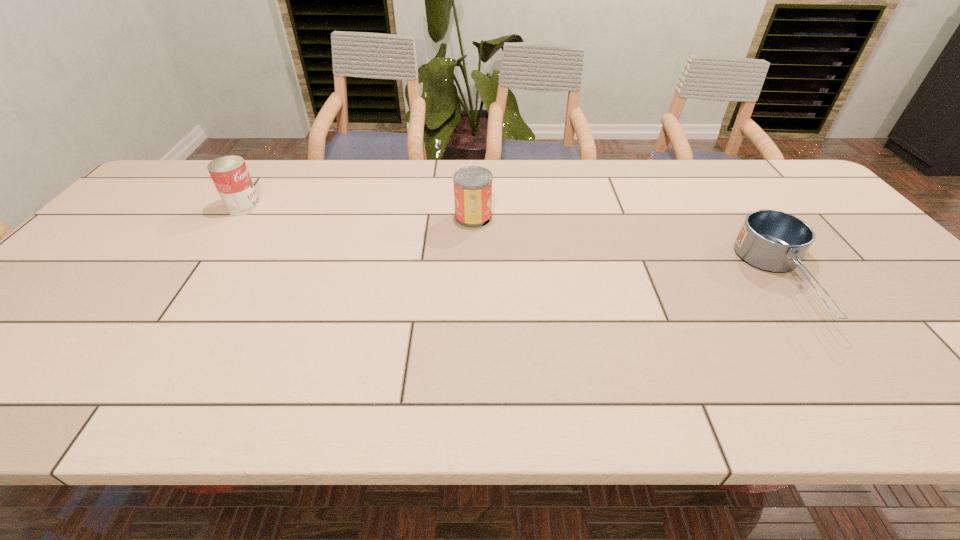
Where is `free space at the left edge`? This screenshot has height=540, width=960. free space at the left edge is located at coordinates (112, 247).

Identify the location of free space at the right edge of the desktop. Image resolution: width=960 pixels, height=540 pixels. (893, 286).

In the image, there is a desktop. Where is `free space at the far right corner`? The width and height of the screenshot is (960, 540). free space at the far right corner is located at coordinates (816, 194).

Image resolution: width=960 pixels, height=540 pixels. In order to click on free space between the left can and the right can in this screenshot , I will do `click(358, 212)`.

What are the coordinates of `free area in between the shortest object and the right can` in the screenshot? It's located at (629, 249).

Locate an element on the screen. The width and height of the screenshot is (960, 540). free space between the left can and the shortest object is located at coordinates (514, 245).

Image resolution: width=960 pixels, height=540 pixels. I want to click on vacant area between the nearest object and the right can, so click(x=629, y=249).

Locate an element on the screen. vacant area between the right can and the left can is located at coordinates (358, 212).

Identify the location of free space between the leftmost object and the shortest object. (514, 245).

Find the location of a particular element. Image resolution: width=960 pixels, height=540 pixels. free spot between the leftmost object and the second object from right to left is located at coordinates (358, 212).